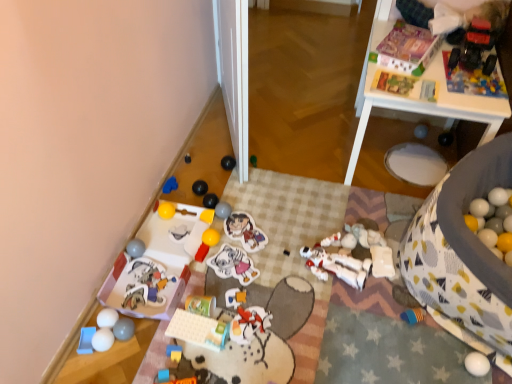
Where is `vacant space to the right of rubber yellow block at lower center, marked as the eleventh toy in a left-to-right arrangement`? vacant space to the right of rubber yellow block at lower center, marked as the eleventh toy in a left-to-right arrangement is located at coordinates (221, 349).